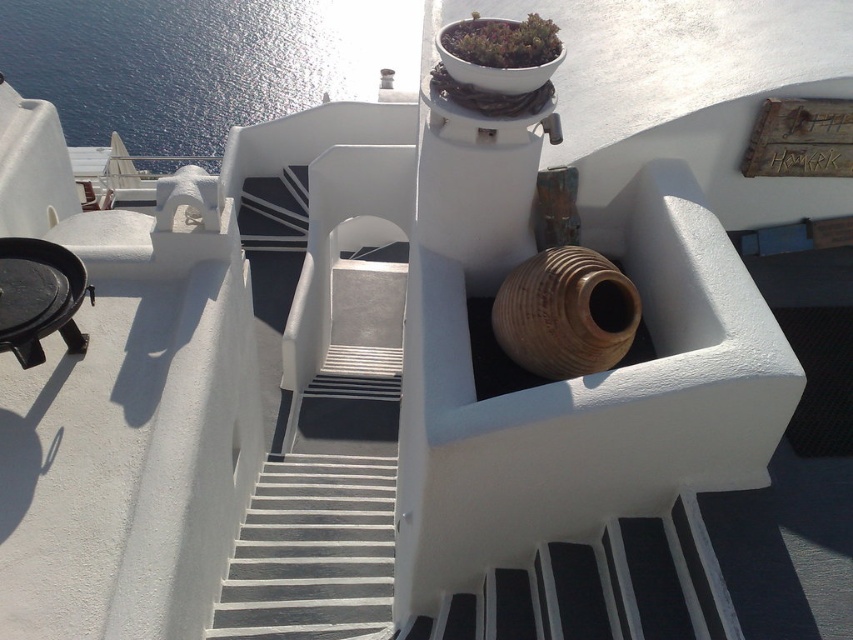
Is blue water at upper left to the right of green matte pot at upper center from the viewer's perspective?

Incorrect, blue water at upper left is not on the right side of green matte pot at upper center.

Does blue water at upper left have a lesser width compared to green matte pot at upper center?

No.

Where is `blue water at upper left`? blue water at upper left is located at coordinates (199, 61).